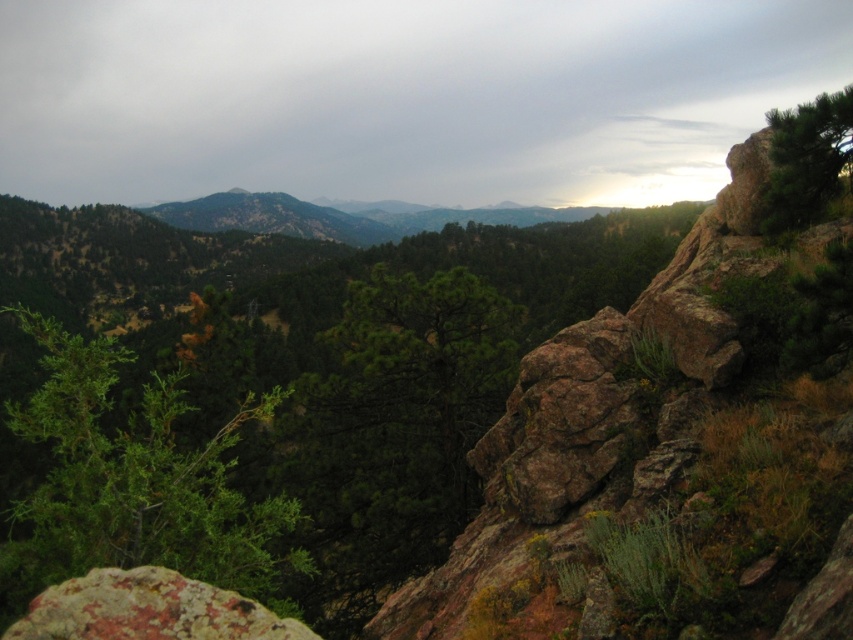
Question: Which of the following is the farthest from the observer?

Choices:
 (A) (231, 522)
 (B) (289, 621)

Answer: (A)

Question: Can you confirm if lichen-covered rock at lower left is wider than green textured pine tree at upper right?

Choices:
 (A) yes
 (B) no

Answer: (B)

Question: Can you confirm if green leafy tree at center is positioned to the right of lichen-covered rock at lower left?

Choices:
 (A) yes
 (B) no

Answer: (B)

Question: Which point is closer to the camera?

Choices:
 (A) (843, 176)
 (B) (218, 596)
 (C) (94, 531)

Answer: (B)

Question: Can you confirm if lichen-covered rock at lower left is smaller than green textured pine tree at upper right?

Choices:
 (A) yes
 (B) no

Answer: (A)

Question: Considering the real-world distances, which object is farthest from the green textured pine tree at upper right?

Choices:
 (A) lichen-covered rock at lower left
 (B) green leafy tree at center

Answer: (B)